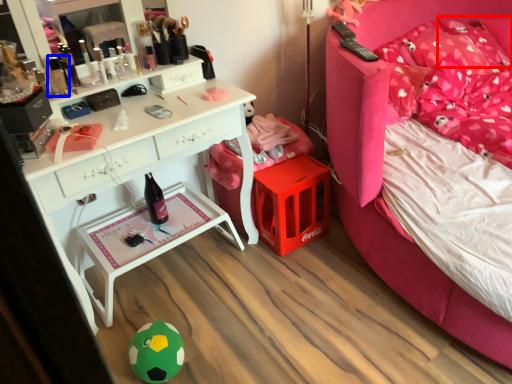
Question: Which object appears farthest to the camera in this image, pillow (highlighted by a red box) or toiletry (highlighted by a blue box)?

Choices:
 (A) pillow
 (B) toiletry

Answer: (A)